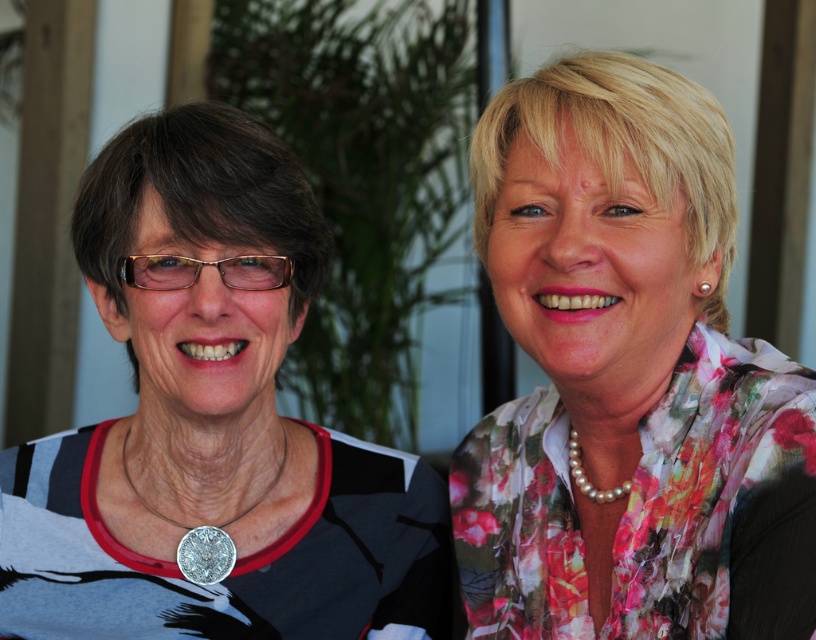
You are a photographer trying to capture a closeup of the silver metallic medal at lower left while ensuring the matte black shirt at left remains visible in the frame. Given their size difference, which object should you focus on to ensure both are in focus?

The matte black shirt at left has a larger size compared to the silver metallic medal at lower left. To ensure both are in focus, focus on the matte black shirt at left since it is larger and will require less adjustment to keep both in the frame.

You are a photographer setting up a shot of two women. You need to ensure that the floral fabric blouse at right and the silver metallic medal at lower left are both visible in the frame. Given their sizes, which object should you focus on first to make sure it fits into the composition?

The floral fabric blouse at right has a greater height compared to the silver metallic medal at lower left, so you should focus on ensuring the floral fabric blouse at right fits into the composition first since it is larger and requires more space.

You are an artist trying to sketch this scene. You want to place the matte black shirt at left in your drawing. Where should you position it in terms of coordinates?

The matte black shirt at left should be positioned at coordinates approximately 0.661 on the x axis and 0.262 on the y axis.